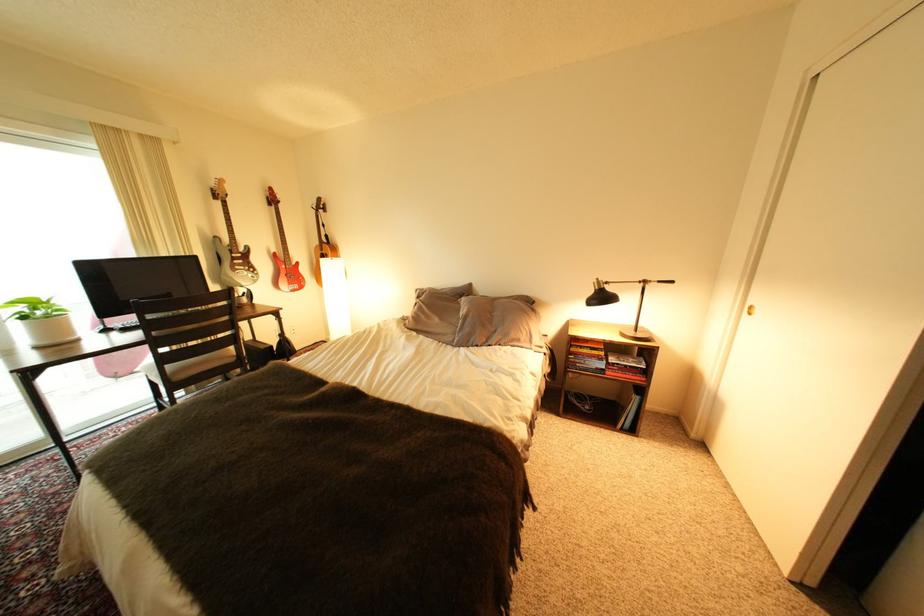
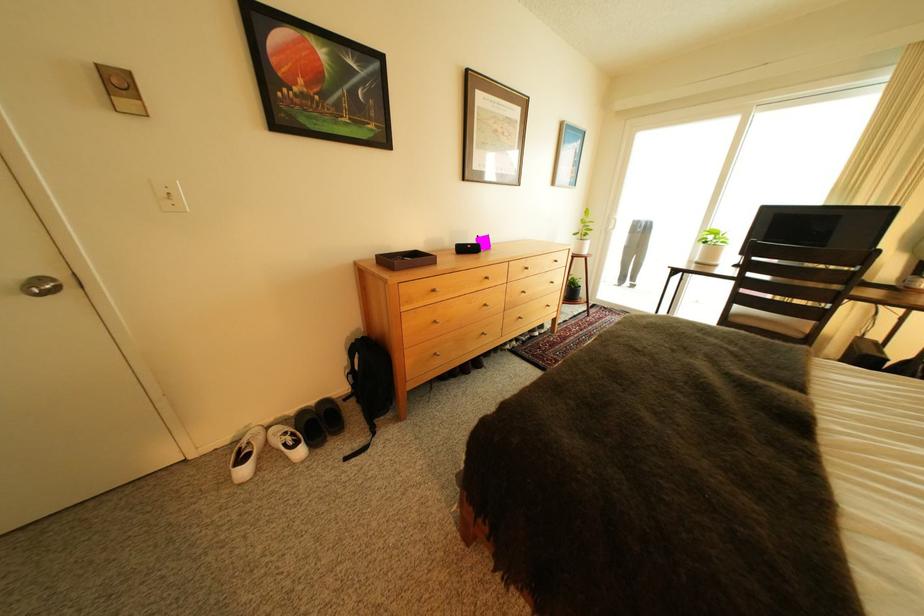
Where in the second image is the point corresponding to the point at 178,368 from the first image?

(748, 307)